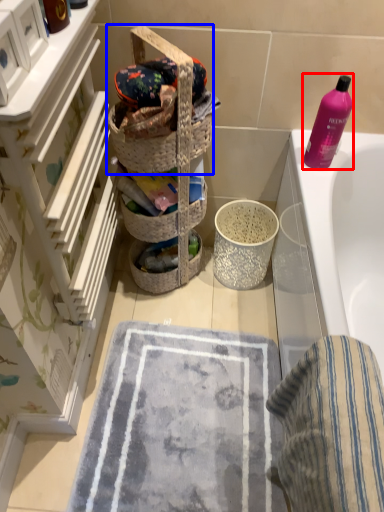
Question: Which object appears farthest to the camera in this image, cleaning product (highlighted by a red box) or picnic basket (highlighted by a blue box)?

Choices:
 (A) cleaning product
 (B) picnic basket

Answer: (A)